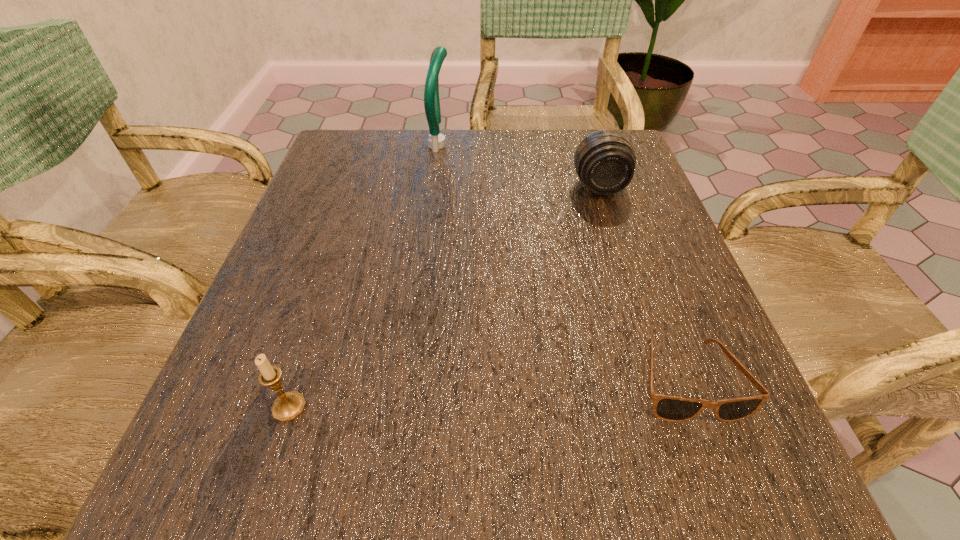
Find the location of a particular element. This screenshot has height=540, width=960. the tallest object is located at coordinates (436, 141).

The image size is (960, 540). I want to click on the farthest object, so click(436, 141).

Identify the location of the third nearest object. (605, 161).

In order to click on candle holder in this screenshot , I will do coord(289,405).

You are a GUI agent. You are given a task and a screenshot of the screen. Output one action in this format:
    pyautogui.click(x=<x>, y=<y>)
    Task: Click on the shortest object
    The image size is (960, 540).
    Given the screenshot: What is the action you would take?
    pyautogui.click(x=669, y=408)

Where is `free region located 0.220m at the jaws of the tallest object`? free region located 0.220m at the jaws of the tallest object is located at coordinates (541, 145).

This screenshot has width=960, height=540. In order to click on vacant area situated 0.330m at the front element of the second farthest object in this screenshot , I will do `click(644, 325)`.

In order to click on free spot located 0.100m on the front of the leftmost object in this screenshot , I will do (x=257, y=503).

Where is `free space located 0.080m on the frames of the sunglasses`? This screenshot has height=540, width=960. free space located 0.080m on the frames of the sunglasses is located at coordinates (726, 485).

In order to click on bottle opener positioned at the far edge in this screenshot , I will do `click(436, 141)`.